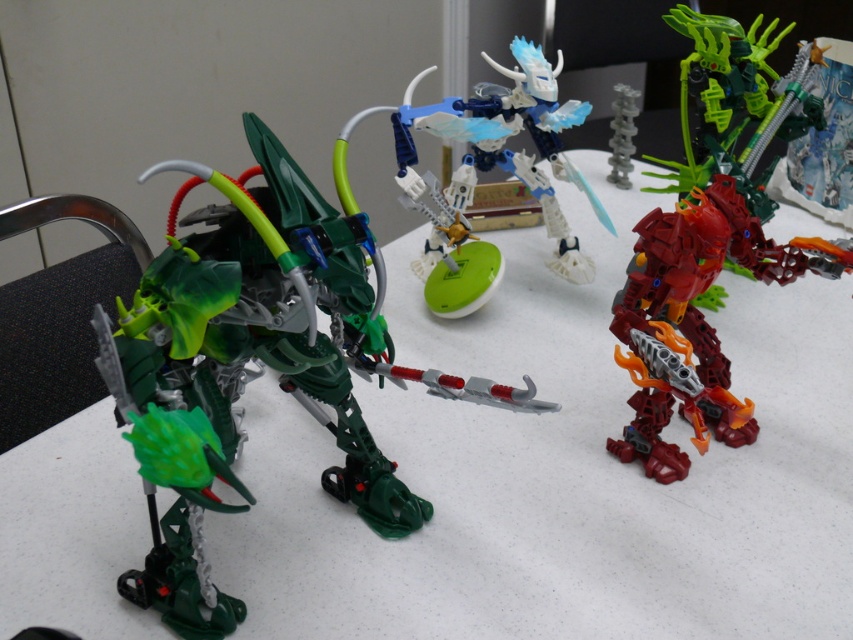
Who is more forward, (721, 380) or (619, 141)?

Positioned in front is point (721, 380).

Does shiny red plastic robot at right lie behind translucent gray spine at center?

No, it is in front of translucent gray spine at center.

Which is behind, point (805, 262) or point (611, 180)?

Positioned behind is point (611, 180).

You are a GUI agent. You are given a task and a screenshot of the screen. Output one action in this format:
    pyautogui.click(x=<x>, y=<y>)
    Task: Click on the shiny red plastic robot at right
    The image size is (853, 640).
    Given the screenshot: What is the action you would take?
    click(x=695, y=316)

Who is taller, green plastic robot at left or shiny red plastic robot at right?

green plastic robot at left

You are a GUI agent. You are given a task and a screenshot of the screen. Output one action in this format:
    pyautogui.click(x=<x>, y=<y>)
    Task: Click on the green plastic robot at left
    This screenshot has width=853, height=640.
    Given the screenshot: What is the action you would take?
    pyautogui.click(x=259, y=364)

Between green plastic robot at left and translucent gray spine at center, which one is positioned lower?

green plastic robot at left

Who is taller, green plastic robot at left or translucent gray spine at center?

green plastic robot at left

At what (x,y) coordinates should I click in order to perform the action: click on green plastic robot at left. Please return your answer as a coordinate pair (x, y). Image resolution: width=853 pixels, height=640 pixels. Looking at the image, I should click on (259, 364).